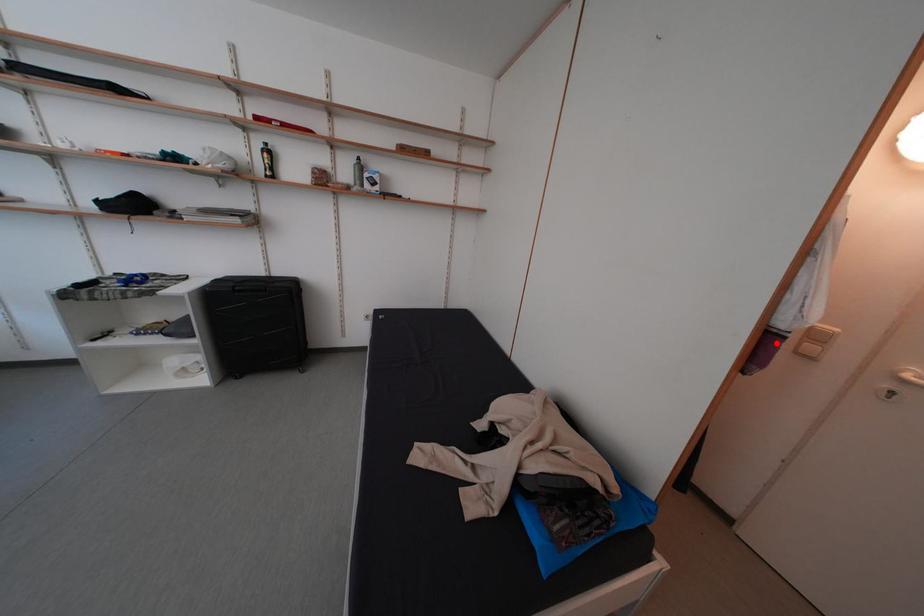
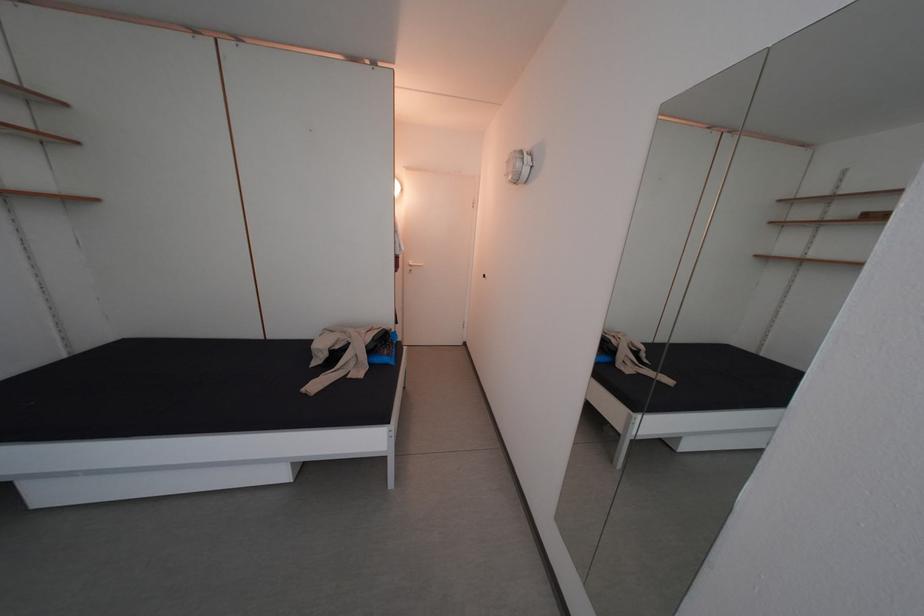
In the second image, find the point that corresponds to the highlighted location in the first image.

(407, 264)